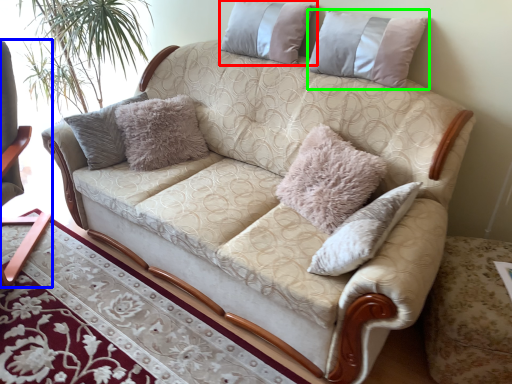
Question: Based on their relative distances, which object is nearer to pillow (highlighted by a red box)? Choose from rocking chair (highlighted by a blue box) and pillow (highlighted by a green box).

Choices:
 (A) rocking chair
 (B) pillow

Answer: (B)